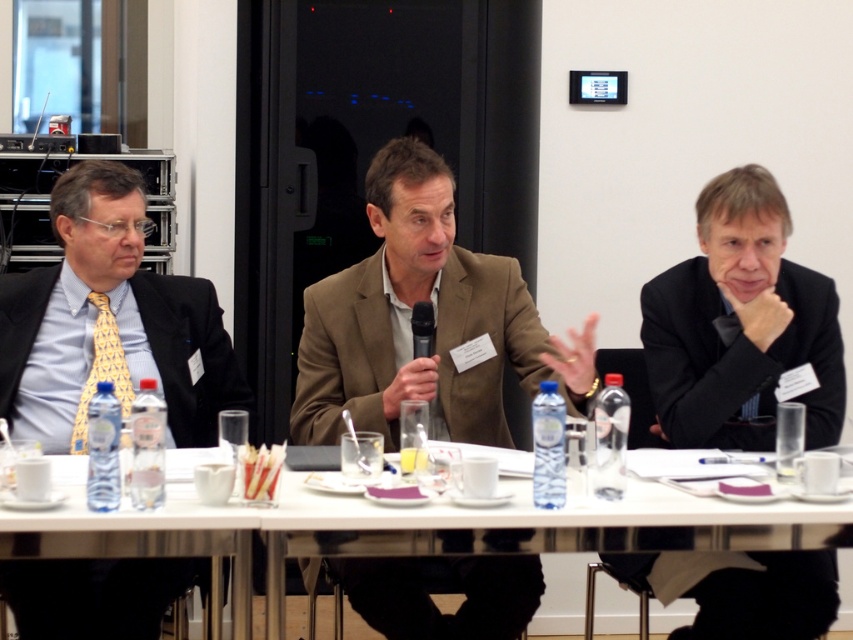
Question: Does brown textured suit at center have a larger size compared to black matte suit at right?

Choices:
 (A) yes
 (B) no

Answer: (A)

Question: Which object appears farthest from the camera in this image?

Choices:
 (A) matte black suit at left
 (B) white plastic table at center
 (C) brown textured suit at center

Answer: (A)

Question: Does black matte suit at right lie in front of yellowgeometric patterned fabrictie at left?

Choices:
 (A) no
 (B) yes

Answer: (A)

Question: Which object is positioned farthest from the white plastic table at center?

Choices:
 (A) black matte suit at right
 (B) brown textured suit at center
 (C) matte black suit at left

Answer: (C)

Question: Which object is closer to the camera taking this photo?

Choices:
 (A) white plastic table at center
 (B) brown textured suit at center
 (C) yellowgeometric patterned fabrictie at left
 (D) black matte suit at right

Answer: (A)

Question: Is brown textured suit at center below matte black suit at left?

Choices:
 (A) no
 (B) yes

Answer: (A)